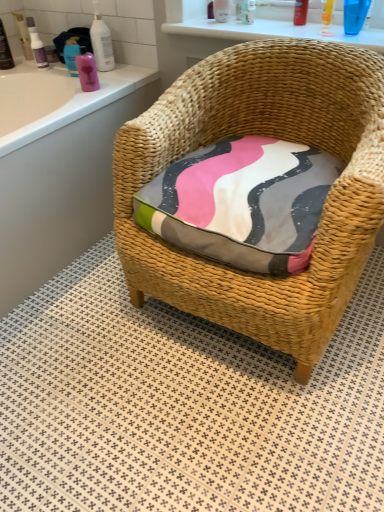
Question: Is white textured tile at center positioned far away from translucent plastic bottle at upper center, acting as the 7th toiletry starting from the left?

Choices:
 (A) yes
 (B) no

Answer: (A)

Question: Is white textured tile at center thinner than translucent plastic bottle at upper center, acting as the 7th toiletry starting from the left?

Choices:
 (A) no
 (B) yes

Answer: (A)

Question: Is white textured tile at center surrounding translucent plastic bottle at upper center, acting as the 7th toiletry starting from the left?

Choices:
 (A) no
 (B) yes

Answer: (A)

Question: Considering the relative sizes of white textured tile at center and translucent plastic bottle at upper center, placed as the fourth toiletry when sorted from right to left, in the image provided, is white textured tile at center wider than translucent plastic bottle at upper center, placed as the fourth toiletry when sorted from right to left,?

Choices:
 (A) no
 (B) yes

Answer: (B)

Question: Is white textured tile at center located outside translucent plastic bottle at upper center, placed as the fourth toiletry when sorted from right to left?

Choices:
 (A) no
 (B) yes

Answer: (B)

Question: Is pink glossy bottle at upper left, the fifth toiletry viewed from the left, inside the boundaries of white glossy bottle at upper left, the sixth toiletry viewed from the left, or outside?

Choices:
 (A) inside
 (B) outside

Answer: (B)

Question: Based on their sizes in the image, would you say pink glossy bottle at upper left, which is counted as the 6th toiletry, starting from the right, is bigger or smaller than white glossy bottle at upper left, the fifth toiletry in the right-to-left sequence?

Choices:
 (A) small
 (B) big

Answer: (A)

Question: From a real-world perspective, relative to white glossy bottle at upper left, the fifth toiletry in the right-to-left sequence, is pink glossy bottle at upper left, which is counted as the 6th toiletry, starting from the right, vertically above or below?

Choices:
 (A) below
 (B) above

Answer: (A)

Question: Is pink glossy bottle at upper left, which is counted as the 6th toiletry, starting from the right, taller or shorter than white glossy bottle at upper left, the sixth toiletry viewed from the left?

Choices:
 (A) tall
 (B) short

Answer: (B)

Question: Considering the positions of matte plastic bottle at upper left, acting as the 9th toiletry starting from the right, and translucent plastic bottle at upper center, which is the eighth toiletry in left-to-right order, in the image, is matte plastic bottle at upper left, acting as the 9th toiletry starting from the right, wider or thinner than translucent plastic bottle at upper center, which is the eighth toiletry in left-to-right order,?

Choices:
 (A) thin
 (B) wide

Answer: (B)

Question: Is matte plastic bottle at upper left, the 2th toiletry in the left-to-right sequence, bigger or smaller than translucent plastic bottle at upper center, which is the eighth toiletry in left-to-right order?

Choices:
 (A) small
 (B) big

Answer: (B)

Question: Would you say matte plastic bottle at upper left, the 2th toiletry in the left-to-right sequence, is to the left or to the right of translucent plastic bottle at upper center, which is the eighth toiletry in left-to-right order, in the picture?

Choices:
 (A) right
 (B) left

Answer: (B)

Question: Is matte plastic bottle at upper left, acting as the 9th toiletry starting from the right, in front of or behind translucent plastic bottle at upper center, which is the eighth toiletry in left-to-right order, in the image?

Choices:
 (A) front
 (B) behind

Answer: (B)

Question: Is point (19, 34) positioned closer to the camera than point (46, 67)?

Choices:
 (A) farther
 (B) closer

Answer: (A)

Question: In the image, is matte plastic bottle at upper left, the 2th toiletry in the left-to-right sequence, on the left side or the right side of translucent plastic bottle at upper left, which is the eighth toiletry from right to left?

Choices:
 (A) right
 (B) left

Answer: (B)